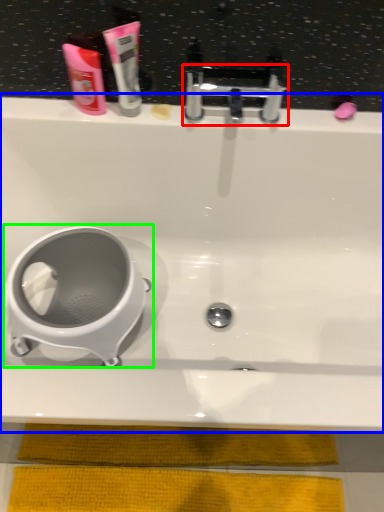
Question: Which is nearer to the tap (highlighted by a red box)? bathtub (highlighted by a blue box) or toilet (highlighted by a green box).

Choices:
 (A) bathtub
 (B) toilet

Answer: (A)